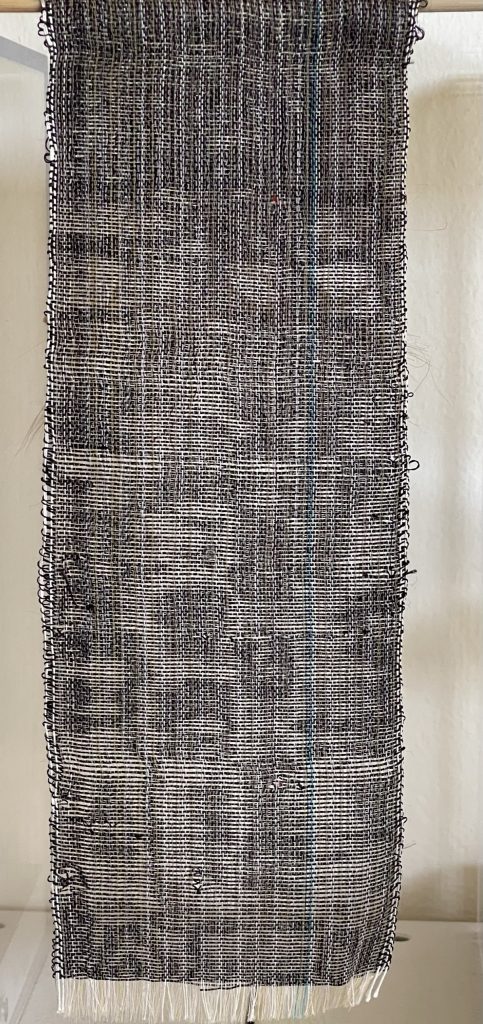
The image size is (483, 1024). I want to click on white background wall, so click(x=453, y=144).